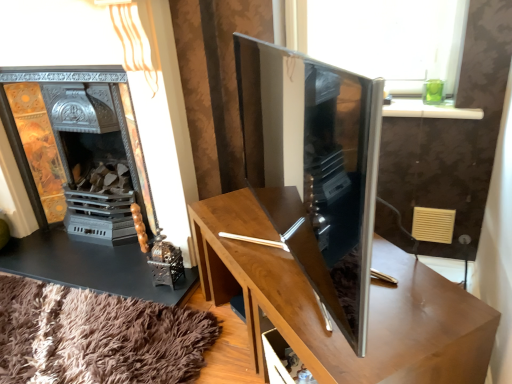
At what (x,y) coordinates should I click in order to perform the action: click on vacant area on top of wooden table at center (from a real-world perspective). Please return your answer as a coordinate pair (x, y). The width and height of the screenshot is (512, 384). Looking at the image, I should click on (310, 287).